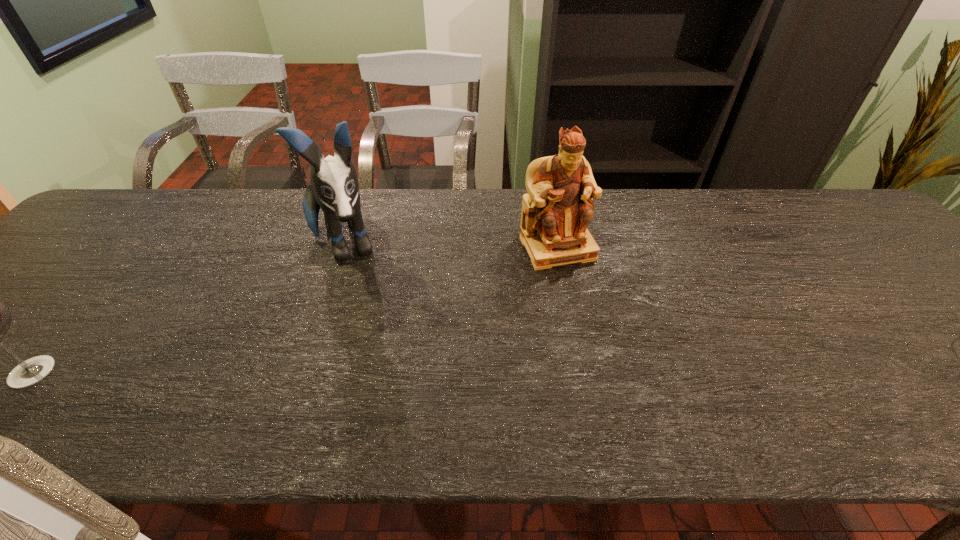
The width and height of the screenshot is (960, 540). What are the coordinates of `the second object from right to left` in the screenshot? It's located at (333, 186).

Find the location of a particular element. The image size is (960, 540). puppy is located at coordinates (333, 186).

At what (x,y) coordinates should I click in order to perform the action: click on the rightmost object. Please return your answer as a coordinate pair (x, y). Looking at the image, I should click on (556, 212).

This screenshot has width=960, height=540. Find the location of `figurine`. figurine is located at coordinates (556, 212).

I want to click on vacant region located on the front-facing side of the second object from right to left, so click(x=362, y=338).

What are the coordinates of `vacant area situated on the front-facing side of the second object from right to left` in the screenshot? It's located at (360, 331).

Where is `free spot located 0.210m on the front-facing side of the second object from right to left`? This screenshot has width=960, height=540. free spot located 0.210m on the front-facing side of the second object from right to left is located at coordinates (365, 348).

Find the location of a particular element. The width and height of the screenshot is (960, 540). free space located 0.240m on the front-facing side of the figurine is located at coordinates (608, 344).

This screenshot has width=960, height=540. What are the coordinates of `vacant space located 0.340m on the front-facing side of the figurine` in the screenshot? It's located at (629, 383).

Find the location of a particular element. The width and height of the screenshot is (960, 540). blank space located 0.170m on the front-facing side of the figurine is located at coordinates (595, 320).